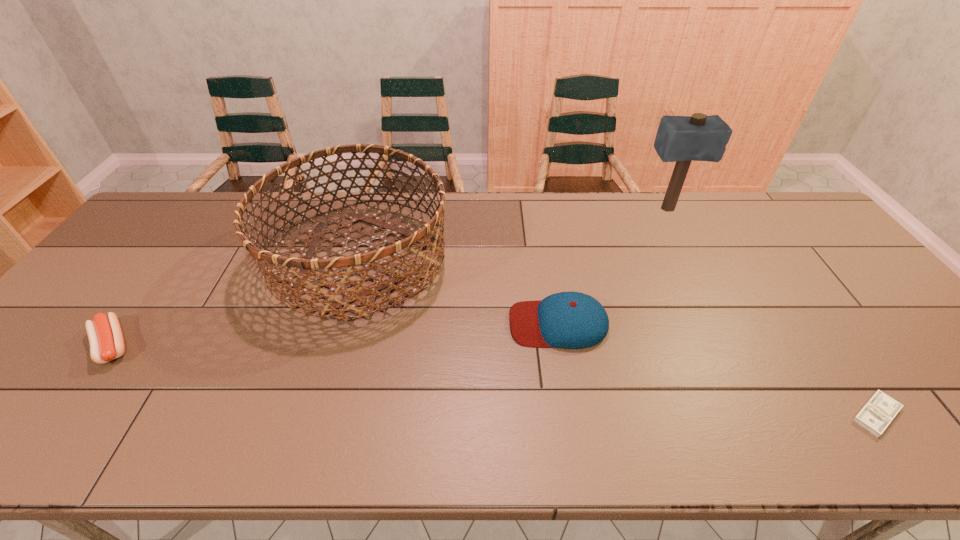
Find the location of `object situated at the left edge`. object situated at the left edge is located at coordinates (106, 341).

In the image, there is a desktop. Where is `free space at the far edge`? The height and width of the screenshot is (540, 960). free space at the far edge is located at coordinates (736, 232).

In the image, there is a desktop. Identify the location of vacant space at the near edge. Image resolution: width=960 pixels, height=540 pixels. (512, 435).

You are a GUI agent. You are given a task and a screenshot of the screen. Output one action in this format:
    pyautogui.click(x=<x>, y=<y>)
    Task: Click on the vacant space at the left edge of the desktop
    Image resolution: width=960 pixels, height=540 pixels.
    Given the screenshot: What is the action you would take?
    pyautogui.click(x=171, y=238)

Image resolution: width=960 pixels, height=540 pixels. I want to click on free spot at the right edge of the desktop, so click(x=818, y=261).

In the image, there is a desktop. Where is `free space at the far right corner`? free space at the far right corner is located at coordinates (x=770, y=200).

Where is `free space between the tallest object and the second object from left to right`? This screenshot has height=540, width=960. free space between the tallest object and the second object from left to right is located at coordinates (514, 234).

I want to click on free area in between the third object from right to left and the fourth object from left to right, so click(612, 266).

Locate an element on the screen. free spot between the third object from left to right and the rightmost object is located at coordinates (717, 369).

This screenshot has height=540, width=960. Find the location of `free area in between the third shortest object and the fourth object from left to right`. free area in between the third shortest object and the fourth object from left to right is located at coordinates (612, 266).